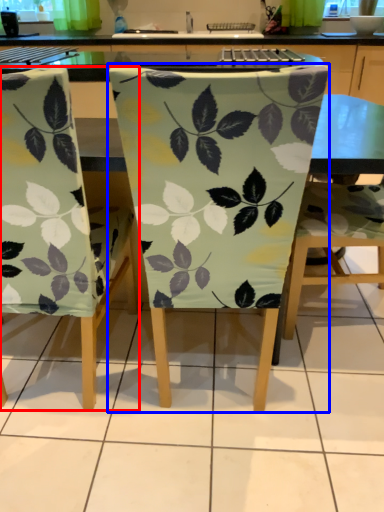
Question: Which of the following is the closest to the observer, chair (highlighted by a red box) or chair (highlighted by a blue box)?

Choices:
 (A) chair
 (B) chair

Answer: (B)